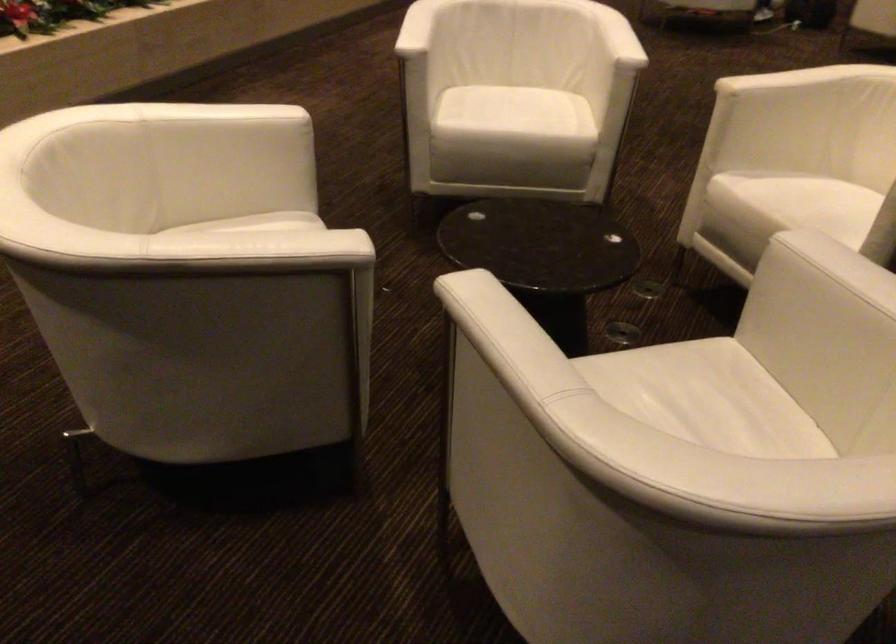
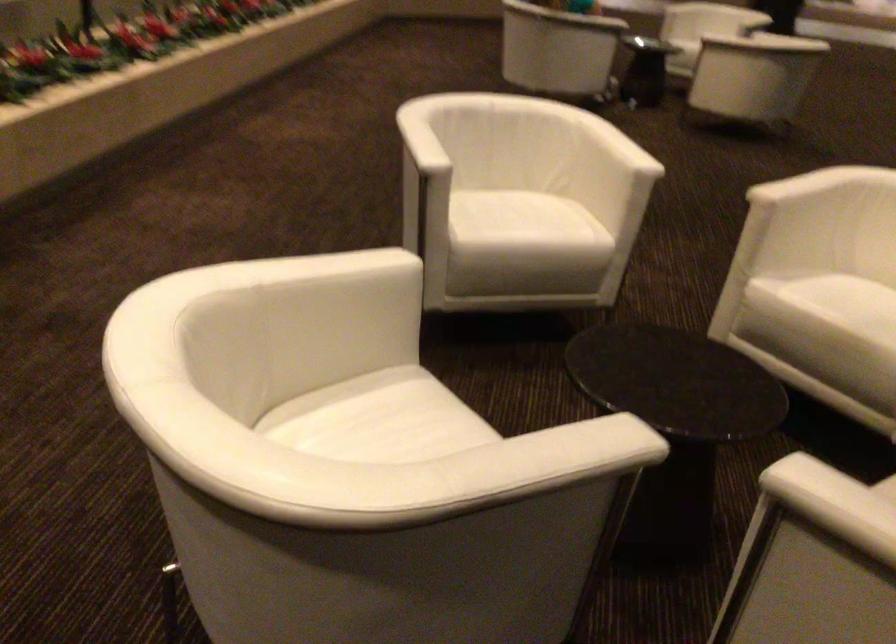
Question: Based on the continuous images, in which direction is the camera rotating? Reply with the corresponding letter.

Choices:
 (A) Left
 (B) Right
 (C) Up
 (D) Down

Answer: (B)